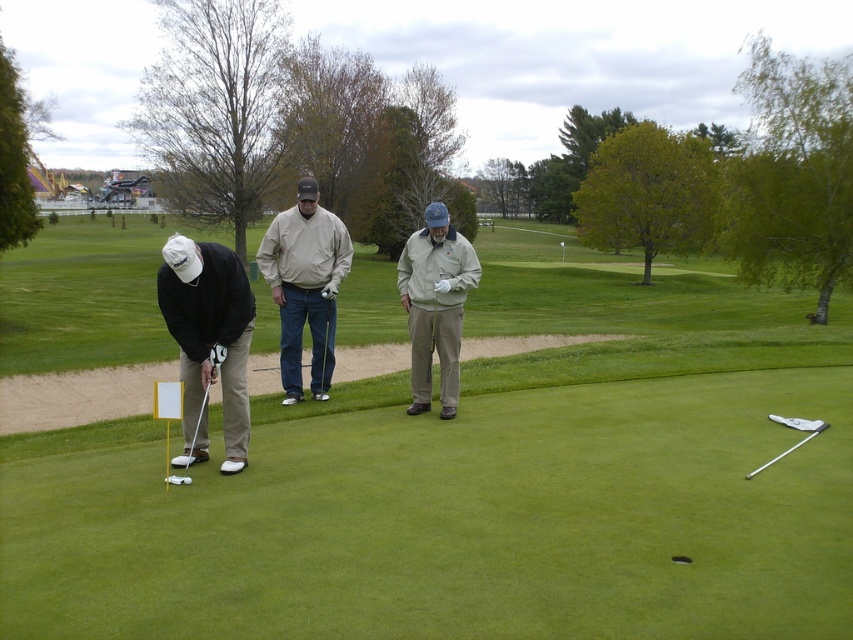
You are a golfer trying to place your matte black golf club at lower left next to the beige cotton shirt at center on the green. Based on their widths, will the club fit without overlapping the shirt?

The matte black golf club at lower left might be wider than beige cotton shirt at center, so there is a possibility it could overlap if placed next to it.

You are a golfer standing at the edge of the green and see the khaki cotton jacket at center and the metallic silver putter at lower left. Which object is closer to you?

The khaki cotton jacket at center is closer to you because it is further to the viewer than the metallic silver putter at lower left.